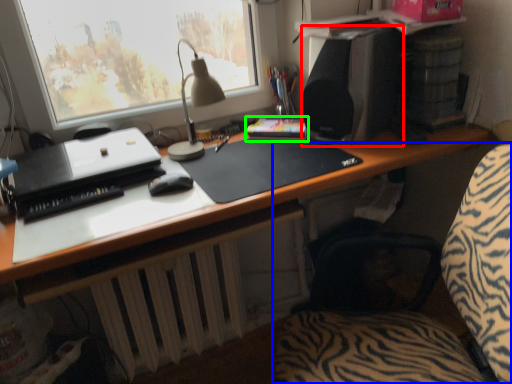
Question: Considering the real-world distances, which object is farthest from loudspeaker (highlighted by a red box)? computer chair (highlighted by a blue box) or paperback book (highlighted by a green box)?

Choices:
 (A) computer chair
 (B) paperback book

Answer: (A)